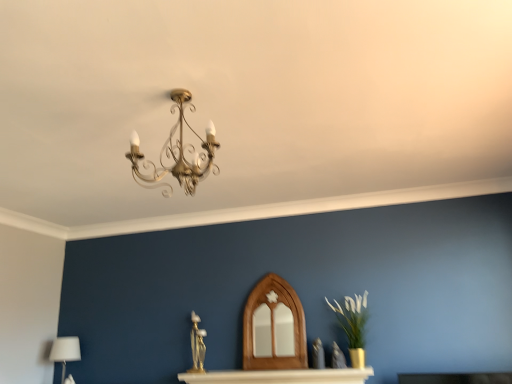
The image size is (512, 384). What do you see at coordinates (280, 376) in the screenshot?
I see `white glossy table at center` at bounding box center [280, 376].

The height and width of the screenshot is (384, 512). In order to click on white fabric lampshade at lower left in this screenshot , I will do `click(65, 352)`.

Between white fabric lampshade at lower left and white glossy table at center, which one is positioned in front?

white glossy table at center.

Would you say white fabric lampshade at lower left is a long distance from white glossy table at center?

Absolutely, white fabric lampshade at lower left is distant from white glossy table at center.

Identify the location of table located underneath the white fabric lampshade at lower left (from a real-world perspective). This screenshot has width=512, height=384. (280, 376).

Is green matte vase at right inside the boundaries of white fabric lampshade at lower left, or outside?

green matte vase at right is located beyond the bounds of white fabric lampshade at lower left.

Consider the image. Does green matte vase at right lie in front of white fabric lampshade at lower left?

Yes, green matte vase at right is closer to the camera.

From the image's perspective, relative to white fabric lampshade at lower left, is green matte vase at right above or below?

From the image's perspective, green matte vase at right appears above white fabric lampshade at lower left.

From a real-world perspective, is green matte vase at right on top of white fabric lampshade at lower left?

Indeed, from a real-world perspective, green matte vase at right stands above white fabric lampshade at lower left.

Is gold metallic chandelier at upper center looking in the opposite direction of white glossy table at center?

No, gold metallic chandelier at upper center is not facing away from white glossy table at center.

From the image's perspective, who appears lower, gold metallic chandelier at upper center or white glossy table at center?

From the image's view, white glossy table at center is below.

How much distance is there between gold metallic chandelier at upper center and white glossy table at center?

gold metallic chandelier at upper center and white glossy table at center are 1.25 meters apart.

From a real-world perspective, is gold metallic chandelier at upper center beneath white glossy table at center?

Incorrect, from a real-world perspective, gold metallic chandelier at upper center is higher than white glossy table at center.

Is gold metallic chandelier at upper center facing away from green matte vase at right?

That's right, gold metallic chandelier at upper center is facing away from green matte vase at right.

Measure the distance from gold metallic chandelier at upper center to green matte vase at right.

gold metallic chandelier at upper center and green matte vase at right are 5.90 feet apart from each other.

From a real-world perspective, who is located lower, gold metallic chandelier at upper center or green matte vase at right?

From a 3D spatial view, green matte vase at right is below.

Considering the sizes of gold metallic chandelier at upper center and green matte vase at right in the image, is gold metallic chandelier at upper center wider or thinner than green matte vase at right?

In the image, gold metallic chandelier at upper center appears to be wider than green matte vase at right.

Consider the image. How much distance is there between white glossy table at center and white fabric lampshade at lower left?

white glossy table at center and white fabric lampshade at lower left are 6.00 feet apart.

Is white glossy table at center not inside white fabric lampshade at lower left?

white glossy table at center is positioned outside white fabric lampshade at lower left.

Which is more to the right, white glossy table at center or white fabric lampshade at lower left?

From the viewer's perspective, white glossy table at center appears more on the right side.

From a real-world perspective, who is located lower, white glossy table at center or white fabric lampshade at lower left?

From a 3D spatial view, white glossy table at center is below.

Considering the relative sizes of gold metallic chandelier at upper center and white fabric lampshade at lower left in the image provided, is gold metallic chandelier at upper center thinner than white fabric lampshade at lower left?

No, gold metallic chandelier at upper center is not thinner than white fabric lampshade at lower left.

Can you confirm if gold metallic chandelier at upper center is shorter than white fabric lampshade at lower left?

No.

What's the angular difference between gold metallic chandelier at upper center and white fabric lampshade at lower left's facing directions?

The angular difference between gold metallic chandelier at upper center and white fabric lampshade at lower left is 0.000293 degrees.

Considering the relative positions of gold metallic chandelier at upper center and white fabric lampshade at lower left in the image provided, is gold metallic chandelier at upper center to the left or to the right of white fabric lampshade at lower left?

From the image, it's evident that gold metallic chandelier at upper center is to the right of white fabric lampshade at lower left.

Which of these two, white fabric lampshade at lower left or green matte vase at right, is wider?

With larger width is white fabric lampshade at lower left.

The height and width of the screenshot is (384, 512). In order to click on plant above the white fabric lampshade at lower left (from the image's perspective) in this screenshot , I will do `click(352, 318)`.

Can you tell me how much white fabric lampshade at lower left and green matte vase at right differ in facing direction?

They differ by 0.362 degrees in their facing directions.

Locate an element on the screen. The width and height of the screenshot is (512, 384). table lamp above the white glossy table at center (from a real-world perspective) is located at coordinates (65, 352).

Image resolution: width=512 pixels, height=384 pixels. In order to click on table lamp located below the green matte vase at right (from the image's perspective) in this screenshot , I will do `click(65, 352)`.

Considering their positions, is white fabric lampshade at lower left positioned closer to gold metallic chandelier at upper center than white glossy table at center?

white glossy table at center is positioned closer to the anchor gold metallic chandelier at upper center.

Which object lies nearer to the anchor point white glossy table at center, green matte vase at right or white fabric lampshade at lower left?

green matte vase at right lies closer to white glossy table at center than the other object.

Based on their spatial positions, is gold metallic chandelier at upper center or green matte vase at right closer to white glossy table at center?

Among the two, green matte vase at right is located nearer to white glossy table at center.

Consider the image. Based on their spatial positions, is white fabric lampshade at lower left or gold metallic chandelier at upper center closer to green matte vase at right?

Among the two, gold metallic chandelier at upper center is located nearer to green matte vase at right.

Looking at the image, which one is located further to gold metallic chandelier at upper center, white fabric lampshade at lower left or green matte vase at right?

Based on the image, white fabric lampshade at lower left appears to be further to gold metallic chandelier at upper center.

Looking at the image, which one is located further to gold metallic chandelier at upper center, white glossy table at center or green matte vase at right?

The object further to gold metallic chandelier at upper center is green matte vase at right.

In the scene shown: Which object lies further to the anchor point green matte vase at right, gold metallic chandelier at upper center or white glossy table at center?

gold metallic chandelier at upper center is further to green matte vase at right.

From the image, which object appears to be farther from green matte vase at right, gold metallic chandelier at upper center or white fabric lampshade at lower left?

white fabric lampshade at lower left lies further to green matte vase at right than the other object.

Locate an element on the screen. The height and width of the screenshot is (384, 512). lamp between white fabric lampshade at lower left and green matte vase at right is located at coordinates (x=177, y=153).

The height and width of the screenshot is (384, 512). Identify the location of table between gold metallic chandelier at upper center and green matte vase at right in the front-back direction. (280, 376).

Where is `table located between gold metallic chandelier at upper center and white fabric lampshade at lower left in the depth direction`? table located between gold metallic chandelier at upper center and white fabric lampshade at lower left in the depth direction is located at coordinates (280, 376).

Image resolution: width=512 pixels, height=384 pixels. I want to click on table between white fabric lampshade at lower left and green matte vase at right, so [280, 376].